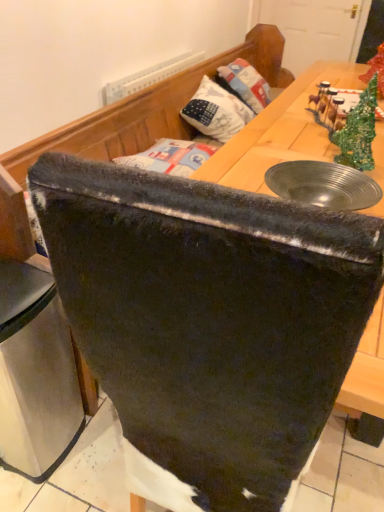
What do you see at coordinates (216, 111) in the screenshot? I see `white fabric pillow at upper center` at bounding box center [216, 111].

In the scene shown: What is the approximate width of velvet black chair at center?

26.06 inches.

This screenshot has width=384, height=512. Find the location of `velvet black chair at center`. velvet black chair at center is located at coordinates (126, 128).

The image size is (384, 512). Identify the location of white fabric pillow at upper center. (216, 111).

Is velvet black chair at center to the left or to the right of white fabric pillow at upper center in the image?

velvet black chair at center is positioned on white fabric pillow at upper center's left side.

Considering the relative sizes of velvet black chair at center and white fabric pillow at upper center in the image provided, is velvet black chair at center taller than white fabric pillow at upper center?

Correct, velvet black chair at center is much taller as white fabric pillow at upper center.

Is velvet black chair at center aimed at white fabric pillow at upper center?

Yes.

Is velvet black chair at center placed right next to white fabric pillow at upper center?

They are not placed beside each other.

Who is bigger, white fabric pillow at upper center or velvet black chair at center?

velvet black chair at center is bigger.

Is white fabric pillow at upper center touching velvet black chair at center?

No, white fabric pillow at upper center is not with velvet black chair at center.

From the image's perspective, does white fabric pillow at upper center appear higher than velvet black chair at center?

Correct, white fabric pillow at upper center appears higher than velvet black chair at center in the image.

Is white fabric pillow at upper center to the left or to the right of velvet black chair at center in the image?

Based on their positions, white fabric pillow at upper center is located to the right of velvet black chair at center.

Is velvet black chair at center facing towards velvet black chair at center?

No, velvet black chair at center does not turn towards velvet black chair at center.

Is velvet black chair at center taller than velvet black chair at center?

Indeed, velvet black chair at center has a greater height compared to velvet black chair at center.

Consider the image. From a real-world perspective, between velvet black chair at center and velvet black chair at center, who is vertically higher?

velvet black chair at center.

Between velvet black chair at center and velvet black chair at center, which one has larger width?

velvet black chair at center.

Looking at the image, does velvet black chair at center seem bigger or smaller compared to stainless steel trash can at lower left?

Clearly, velvet black chair at center is larger in size than stainless steel trash can at lower left.

Between velvet black chair at center and stainless steel trash can at lower left, which one appears on the right side from the viewer's perspective?

From the viewer's perspective, velvet black chair at center appears more on the right side.

Locate an element on the screen. This screenshot has width=384, height=512. leftover located below the velvet black chair at center (from the image's perspective) is located at coordinates (35, 373).

Could you tell me if velvet black chair at center is turned towards stainless steel trash can at lower left?

No, velvet black chair at center does not turn towards stainless steel trash can at lower left.

Could you tell me if white fabric pillow at upper center is turned towards stainless steel trash can at lower left?

No.

From the image's perspective, is white fabric pillow at upper center positioned above or below stainless steel trash can at lower left?

white fabric pillow at upper center is situated higher than stainless steel trash can at lower left in the image.

Consider the image. Are white fabric pillow at upper center and stainless steel trash can at lower left far apart?

white fabric pillow at upper center is far away from stainless steel trash can at lower left.

Between white fabric pillow at upper center and stainless steel trash can at lower left, which one appears on the right side from the viewer's perspective?

Positioned to the right is white fabric pillow at upper center.

Which object is closer to the camera, white fabric pillow at upper center or velvet black chair at center?

velvet black chair at center is in front.

Can you confirm if white fabric pillow at upper center is positioned to the right of velvet black chair at center?

Result: Correct, you'll find white fabric pillow at upper center to the right of velvet black chair at center.

Find the location of a particular element. This screenshot has width=384, height=512. pillow on the right of the velvet black chair at center is located at coordinates (216, 111).

Can velvet black chair at center be found inside velvet black chair at center?

No, velvet black chair at center is not a part of velvet black chair at center.

Considering the sizes of objects velvet black chair at center and velvet black chair at center in the image provided, who is thinner, velvet black chair at center or velvet black chair at center?

velvet black chair at center.

From the picture: Can you confirm if velvet black chair at center is shorter than velvet black chair at center?

Yes.

Is velvet black chair at center in front of velvet black chair at center?

That is False.

The height and width of the screenshot is (512, 384). I want to click on pillow that appears behind the velvet black chair at center, so click(x=216, y=111).

At what (x,y) coordinates should I click in order to perform the action: click on pillow above the velvet black chair at center (from the image's perspective). Please return your answer as a coordinate pair (x, y). This screenshot has width=384, height=512. Looking at the image, I should click on (216, 111).

When comparing their distances from velvet black chair at center, does white fabric pillow at upper center or velvet black chair at center seem closer?

Among the two, white fabric pillow at upper center is located nearer to velvet black chair at center.

Looking at the image, which one is located further to velvet black chair at center, velvet black chair at center or white fabric pillow at upper center?

Among the two, velvet black chair at center is located further to velvet black chair at center.

From the image, which object appears to be farther from velvet black chair at center, velvet black chair at center or stainless steel trash can at lower left?

velvet black chair at center is further to velvet black chair at center.

When comparing their distances from velvet black chair at center, does velvet black chair at center or stainless steel trash can at lower left seem closer?

stainless steel trash can at lower left.

Estimate the real-world distances between objects in this image. Which object is further from velvet black chair at center, white fabric pillow at upper center or stainless steel trash can at lower left?

The object further to velvet black chair at center is stainless steel trash can at lower left.

Considering their positions, is white fabric pillow at upper center positioned further to stainless steel trash can at lower left than velvet black chair at center?

Based on the image, white fabric pillow at upper center appears to be further to stainless steel trash can at lower left.

From the image, which object appears to be farther from white fabric pillow at upper center, stainless steel trash can at lower left or velvet black chair at center?

velvet black chair at center is further to white fabric pillow at upper center.

Which object lies further to the anchor point stainless steel trash can at lower left, velvet black chair at center or white fabric pillow at upper center?

white fabric pillow at upper center.

I want to click on leftover positioned between velvet black chair at center and white fabric pillow at upper center from near to far, so click(x=35, y=373).

Identify the location of furniture between stainless steel trash can at lower left and white fabric pillow at upper center along the z-axis. Image resolution: width=384 pixels, height=512 pixels. 126,128.

I want to click on furniture located between velvet black chair at center and white fabric pillow at upper center in the depth direction, so click(x=126, y=128).

Where is `chair between velvet black chair at center and stainless steel trash can at lower left in the up-down direction`? chair between velvet black chair at center and stainless steel trash can at lower left in the up-down direction is located at coordinates (209, 317).